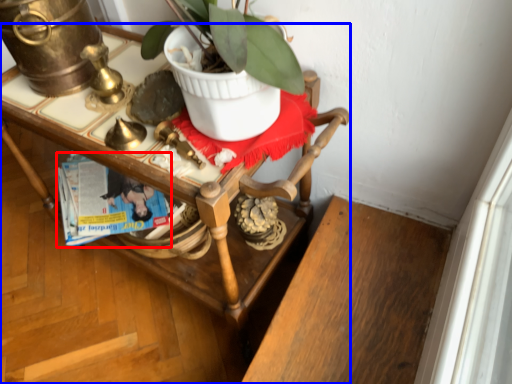
Question: Which point is further to the camera, magazine (highlighted by a red box) or desk (highlighted by a blue box)?

Choices:
 (A) magazine
 (B) desk

Answer: (A)